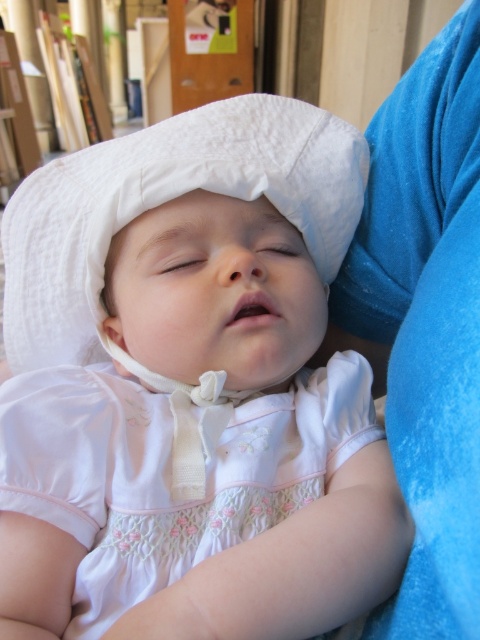
You are a tailor preparing to alter the white satin dress at center and the white cotton bonnet at center. You need to know which item requires more fabric for adjustments. Based on their widths, which item should you prepare more fabric for?

The white cotton bonnet at center has a greater width than the white satin dress at center, so you should prepare more fabric for the white cotton bonnet at center.

Based on the scene description, where is the white satin dress at center located in the image?

The white satin dress at center is located at the 2D point coordinates of 0.738 along the x axis and 0.348 along the y axis.

You are a photographer taking a closeup shot of the baby. You want to focus on the white cotton bonnet at upper center. Given that the camera is set to focus on the point at coordinates point [191,388], will the focus be on the correct object?

Yes, the focus will be on the correct object because point [191,388] corresponds to the white cotton bonnet at upper center.